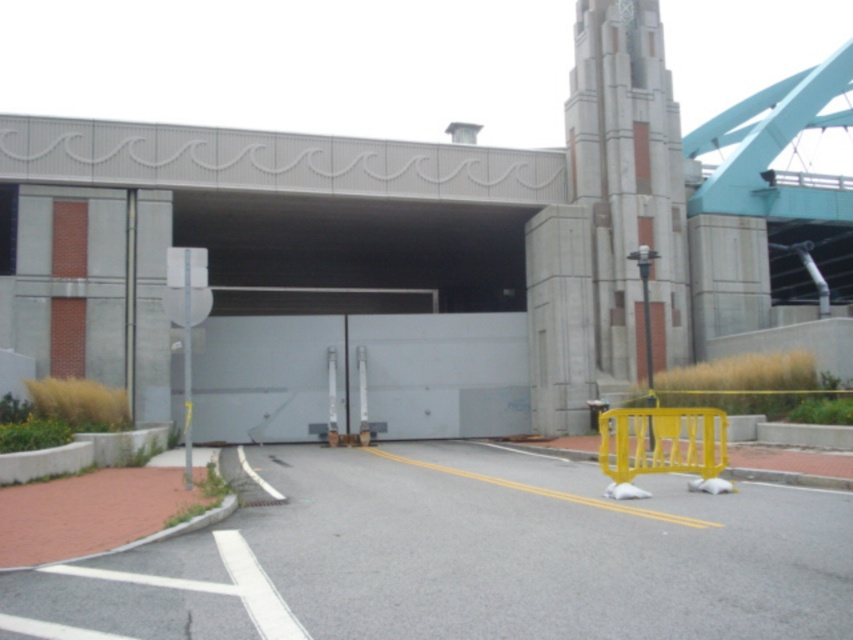
You are driving a delivery truck that is 10 meters long. You see the gray concrete parking garage at center. Can your truck fit into it?

The gray concrete parking garage at center is 12.43 meters from the camera, so the truck is 10 meters long, so it can fit.

You are driving a delivery van that is 7 meters long. You need to enter the gray concrete parking garage at center from the road. There is a yellow plastic barricade at lower right in your path. Can your van safely navigate around the barricade to enter the garage?

The gray concrete parking garage at center is 12.86 meters away from the yellow plastic barricade at lower right. Since the van is 7 meters long, it can safely navigate around the barricade as the distance between them allows enough space for maneuvering.

Based on the photo, you are a delivery driver who needs to park your truck in the parking space on the left side of the road. The truck requires a parking spot that is at least 5 meters long. The parking spaces on the left side of the road are marked with white lines. Can you determine if the parking space near the gray concrete parking garage at center is suitable for your truck?

The parking space near the gray concrete parking garage at center is marked with white lines, but the description does not provide information about the length of the parking spaces. Therefore, it is unclear if the parking space is at least 5 meters long to accommodate the truck.